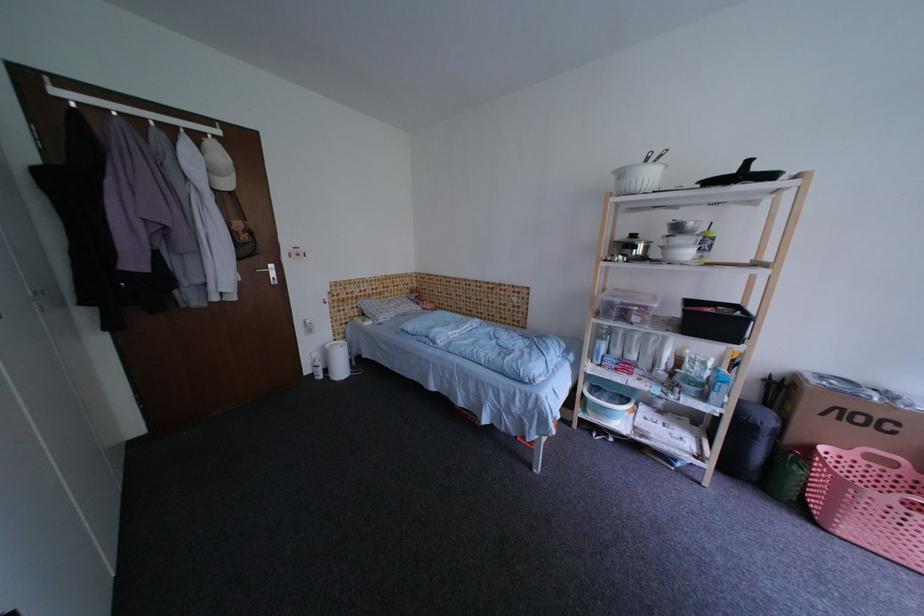
The location [785,477] corresponds to which object?

It refers to a green drawstring bag.